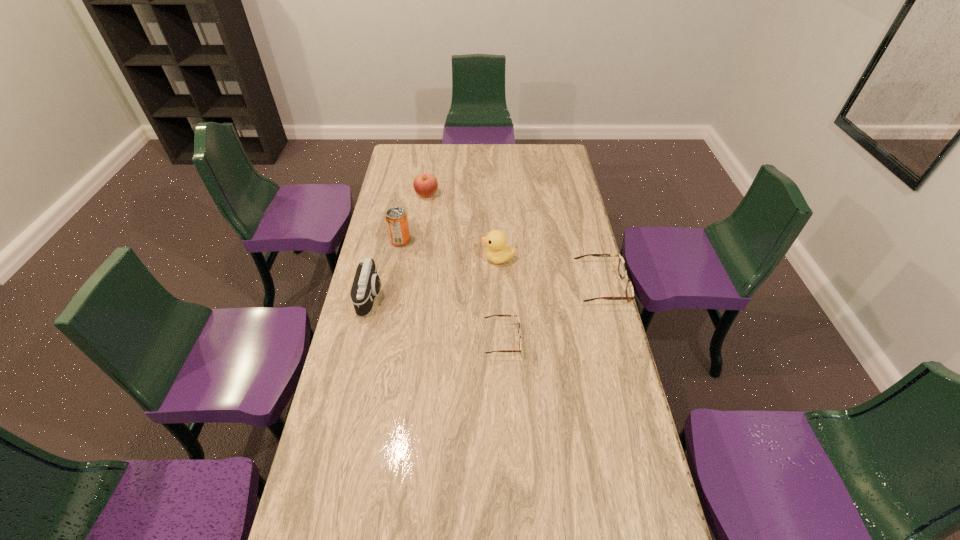
Where is `vacant spot to place a spectacles on the left`? The image size is (960, 540). vacant spot to place a spectacles on the left is located at coordinates (378, 407).